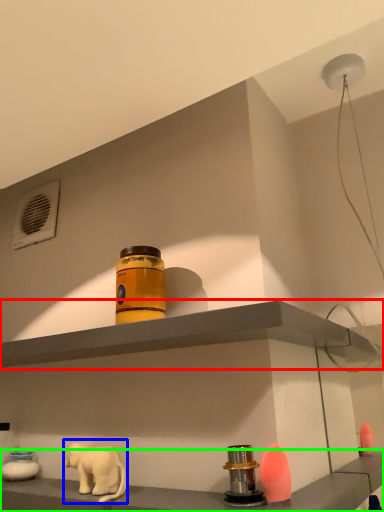
Question: Which object is positioned farthest from shelf (highlighted by a red box)? Select from elephant (highlighted by a blue box) and shelf (highlighted by a green box).

Choices:
 (A) elephant
 (B) shelf

Answer: (A)